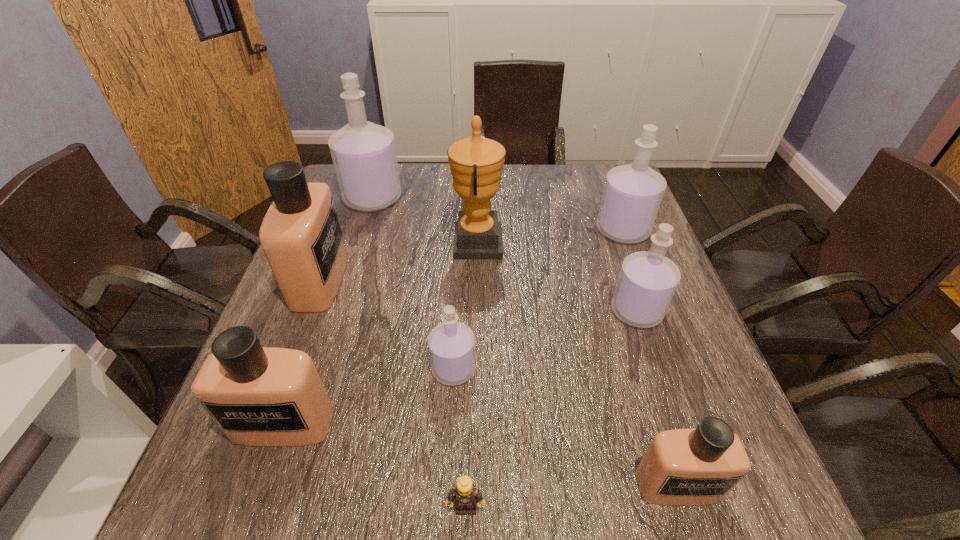
Locate an element on the screen. This screenshot has width=960, height=540. blank area in the image that satisfies the following two spatial constraints: 1. on the front side of the leftmost purple perfume; 2. on the left side of the second biggest purple perfume is located at coordinates (363, 230).

Where is `free space that satisfies the following two spatial constraints: 1. at the front of the third biggest purple perfume with handles; 2. on the right side of the golden award`? free space that satisfies the following two spatial constraints: 1. at the front of the third biggest purple perfume with handles; 2. on the right side of the golden award is located at coordinates (476, 311).